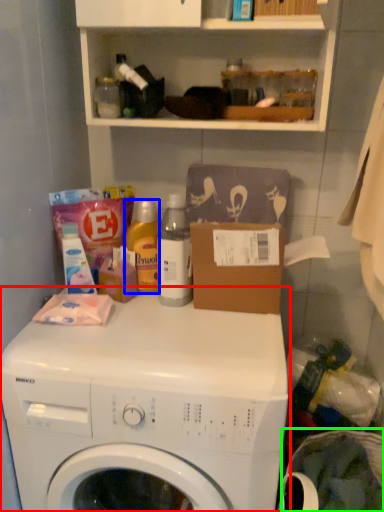
Question: Based on their relative distances, which object is nearer to washing machine (highlighted by a red box)? Choose from cleaning product (highlighted by a blue box) and laundry basket (highlighted by a green box).

Choices:
 (A) cleaning product
 (B) laundry basket

Answer: (A)